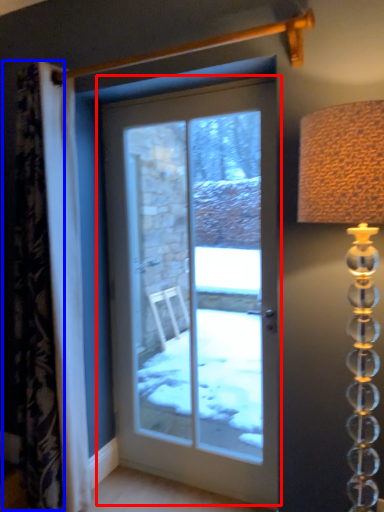
Question: Which point is further to the camera, door (highlighted by a red box) or curtain (highlighted by a blue box)?

Choices:
 (A) door
 (B) curtain

Answer: (A)